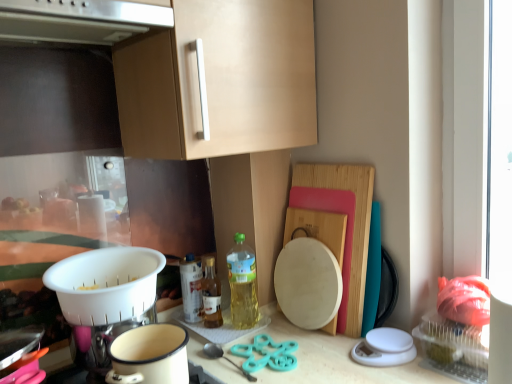
Describe the element at coordinates (191, 288) in the screenshot. I see `translucent glass bottle at center, which appears as the 1th bottle when viewed from the left` at that location.

Identify the location of white enamel pot at lower center. Image resolution: width=512 pixels, height=384 pixels. (149, 356).

Where is `translucent glass bottle at center, the second bottle positioned from the right`? translucent glass bottle at center, the second bottle positioned from the right is located at coordinates (211, 295).

Image resolution: width=512 pixels, height=384 pixels. Find the location of `satin silver exhaust hood at upper center`. satin silver exhaust hood at upper center is located at coordinates (79, 20).

Where is `teal plastic scissors at center`? teal plastic scissors at center is located at coordinates (224, 358).

In the scene shown: Which object is thinner, translucent glass bottle at center, which appears as the 1th bottle when viewed from the left, or wooden cutting board at right?

With smaller width is translucent glass bottle at center, which appears as the 1th bottle when viewed from the left.

The height and width of the screenshot is (384, 512). In order to click on bottle that is the 3rd one when counting leftward from the wooden cutting board at right in this screenshot , I will do `click(191, 288)`.

Choose the correct answer: Is translucent glass bottle at center, which appears as the 1th bottle when viewed from the left, inside wooden cutting board at right or outside it?

translucent glass bottle at center, which appears as the 1th bottle when viewed from the left, cannot be found inside wooden cutting board at right.

Which is in front, translucent glass bottle at center, acting as the 3th bottle starting from the right, or wooden cutting board at right?

wooden cutting board at right is more forward.

Is white enamel pot at lower center situated inside teal plastic scissors at center or outside?

white enamel pot at lower center is not enclosed by teal plastic scissors at center.

From a real-world perspective, is white enamel pot at lower center positioned under teal plastic scissors at center based on gravity?

Actually, white enamel pot at lower center is physically above teal plastic scissors at center in the real world.

Is white enamel pot at lower center thinner than teal plastic scissors at center?

Yes, white enamel pot at lower center is thinner than teal plastic scissors at center.

From the image's perspective, which one is positioned lower, white enamel pot at lower center or teal plastic scissors at center?

teal plastic scissors at center.

Between teal plastic scissors at center and white plastic colander at lower left, which one has smaller width?

Thinner between the two is teal plastic scissors at center.

At what (x,y) coordinates should I click in order to perform the action: click on utensil below the white plastic colander at lower left (from the image's perspective). Please return your answer as a coordinate pair (x, y). This screenshot has width=512, height=384. Looking at the image, I should click on (224, 358).

Is teal plastic scissors at center far away from white plastic colander at lower left?

No, there isn't a large distance between teal plastic scissors at center and white plastic colander at lower left.

Relative to white enamel pot at lower center, is satin silver exhaust hood at upper center in front or behind?

Clearly, satin silver exhaust hood at upper center is in front of white enamel pot at lower center.

Does satin silver exhaust hood at upper center appear on the left side of white enamel pot at lower center?

Yes, satin silver exhaust hood at upper center is to the left of white enamel pot at lower center.

What's the angular difference between satin silver exhaust hood at upper center and white enamel pot at lower center's facing directions?

The facing directions of satin silver exhaust hood at upper center and white enamel pot at lower center are 0.000932 degrees apart.

Could you tell me if satin silver exhaust hood at upper center is facing white enamel pot at lower center?

No, satin silver exhaust hood at upper center is not turned towards white enamel pot at lower center.

Is teal plastic scissors at center facing away from translucent plastic bottle at center, which is the third bottle from left to right?

teal plastic scissors at center is not turned away from translucent plastic bottle at center, which is the third bottle from left to right.

You are a GUI agent. You are given a task and a screenshot of the screen. Output one action in this format:
    pyautogui.click(x=<x>, y=<y>)
    Task: Click on the utensil lying below the translucent plastic bottle at center, which is the third bottle from left to right (from the image's perspective)
    
    Given the screenshot: What is the action you would take?
    pyautogui.click(x=224, y=358)

Is translucent plastic bottle at center, the 1th bottle positioned from the right, located within teal plastic scissors at center?

No, teal plastic scissors at center does not contain translucent plastic bottle at center, the 1th bottle positioned from the right.

From a real-world perspective, between teal plastic scissors at center and translucent plastic bottle at center, which is the third bottle from left to right, who is vertically lower?

teal plastic scissors at center, from a real-world perspective.

Is white enamel pot at lower center not near translucent glass bottle at center, which appears as the 1th bottle when viewed from the left?

white enamel pot at lower center is near translucent glass bottle at center, which appears as the 1th bottle when viewed from the left, not far away.

Is white enamel pot at lower center oriented away from translucent glass bottle at center, which appears as the 1th bottle when viewed from the left?

white enamel pot at lower center is not turned away from translucent glass bottle at center, which appears as the 1th bottle when viewed from the left.

Considering the relative sizes of white enamel pot at lower center and translucent glass bottle at center, which appears as the 1th bottle when viewed from the left, in the image provided, is white enamel pot at lower center wider than translucent glass bottle at center, which appears as the 1th bottle when viewed from the left,?

Correct, the width of white enamel pot at lower center exceeds that of translucent glass bottle at center, which appears as the 1th bottle when viewed from the left.

Between translucent plastic bottle at center, which is the third bottle from left to right, and teal plastic scissors at center, which one has larger width?

teal plastic scissors at center is wider.

Which is farther from the camera, (232, 276) or (226, 359)?

Positioned behind is point (232, 276).

Who is bigger, translucent plastic bottle at center, the 1th bottle positioned from the right, or teal plastic scissors at center?

With larger size is translucent plastic bottle at center, the 1th bottle positioned from the right.

Is the position of translucent plastic bottle at center, which is the third bottle from left to right, more distant than that of teal plastic scissors at center?

Yes, translucent plastic bottle at center, which is the third bottle from left to right, is behind teal plastic scissors at center.

I want to click on cutting board above the translucent glass bottle at center, which appears as the 1th bottle when viewed from the left (from a real-world perspective), so tap(355, 221).

Find the location of a particular element. Image resolution: width=512 pixels, height=384 pixels. coffee cup that appears in front of the teal plastic scissors at center is located at coordinates (149, 356).

Which object lies further to the anchor point satin silver exhaust hood at upper center, wooden cutting board at right or translucent glass bottle at center, acting as the 3th bottle starting from the right?

Among the two, translucent glass bottle at center, acting as the 3th bottle starting from the right, is located further to satin silver exhaust hood at upper center.

Estimate the real-world distances between objects in this image. Which object is further from translucent glass bottle at center, the second bottle positioned from the right, translucent plastic bottle at center, which is the third bottle from left to right, or white enamel pot at lower center?

white enamel pot at lower center lies further to translucent glass bottle at center, the second bottle positioned from the right, than the other object.

Considering their positions, is wooden cutting board at right positioned further to translucent glass bottle at center, the second bottle positioned from the right, than white enamel pot at lower center?

wooden cutting board at right.

Looking at the image, which one is located closer to white plastic colander at lower left, translucent plastic bottle at center, the 1th bottle positioned from the right, or satin silver exhaust hood at upper center?

translucent plastic bottle at center, the 1th bottle positioned from the right, is closer to white plastic colander at lower left.

Considering their positions, is wooden cutting board at right positioned further to translucent plastic bottle at center, which is the third bottle from left to right, than teal plastic scissors at center?

wooden cutting board at right.

Estimate the real-world distances between objects in this image. Which object is closer to translucent glass bottle at center, which is the second bottle in left-to-right order, satin silver exhaust hood at upper center or translucent glass bottle at center, which appears as the 1th bottle when viewed from the left?

The object closer to translucent glass bottle at center, which is the second bottle in left-to-right order, is translucent glass bottle at center, which appears as the 1th bottle when viewed from the left.

Which object lies nearer to the anchor point teal plastic scissors at center, white enamel pot at lower center or satin silver exhaust hood at upper center?

Based on the image, white enamel pot at lower center appears to be nearer to teal plastic scissors at center.

Looking at the image, which one is located closer to translucent glass bottle at center, acting as the 3th bottle starting from the right, translucent plastic bottle at center, the 1th bottle positioned from the right, or satin silver exhaust hood at upper center?

translucent plastic bottle at center, the 1th bottle positioned from the right.

Where is `utensil between white enamel pot at lower center and wooden cutting board at right in the horizontal direction`? utensil between white enamel pot at lower center and wooden cutting board at right in the horizontal direction is located at coordinates (224, 358).

In order to click on bottle situated between translucent glass bottle at center, the second bottle positioned from the right, and wooden cutting board at right from left to right in this screenshot , I will do `click(242, 284)`.

At what (x,y) coordinates should I click in order to perform the action: click on coffee cup between satin silver exhaust hood at upper center and teal plastic scissors at center in the up-down direction. Please return your answer as a coordinate pair (x, y). Looking at the image, I should click on (149, 356).

The width and height of the screenshot is (512, 384). What are the coordinates of `appliance between white enamel pot at lower center and translucent glass bottle at center, which is the second bottle in left-to-right order, in the front-back direction` in the screenshot? It's located at tap(105, 298).